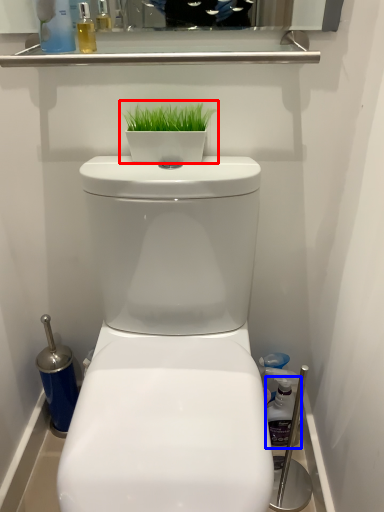
Question: Which point is further to the camera, houseplant (highlighted by a red box) or cleaning product (highlighted by a blue box)?

Choices:
 (A) houseplant
 (B) cleaning product

Answer: (B)